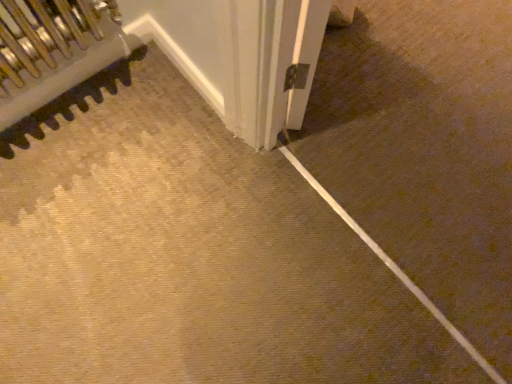
Image resolution: width=512 pixels, height=384 pixels. What do you see at coordinates (394, 268) in the screenshot? I see `beige carpet at lower right` at bounding box center [394, 268].

Where is `beige carpet at lower right`? The image size is (512, 384). beige carpet at lower right is located at coordinates (394, 268).

The image size is (512, 384). I want to click on beige carpet at lower right, so click(x=394, y=268).